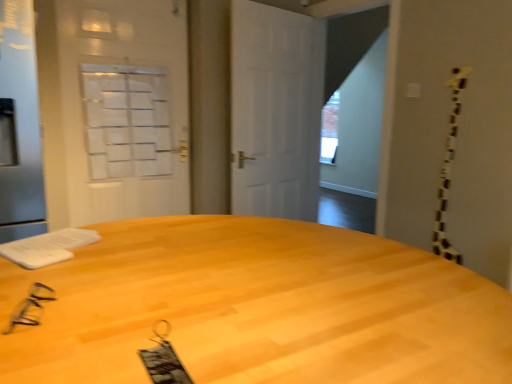
Find the location of a particular element. This screenshot has height=384, width=512. free area behind black plastic glasses at lower left is located at coordinates 77,275.